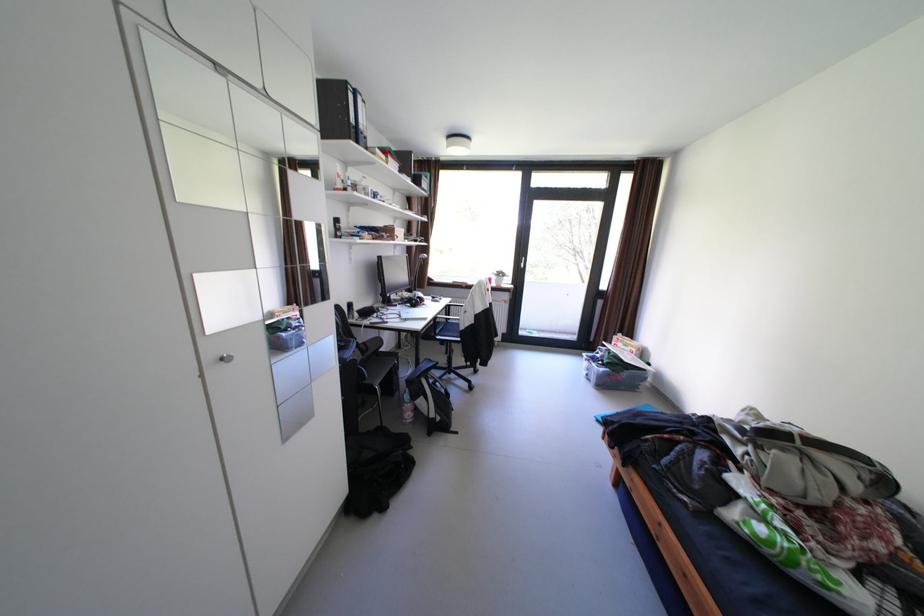
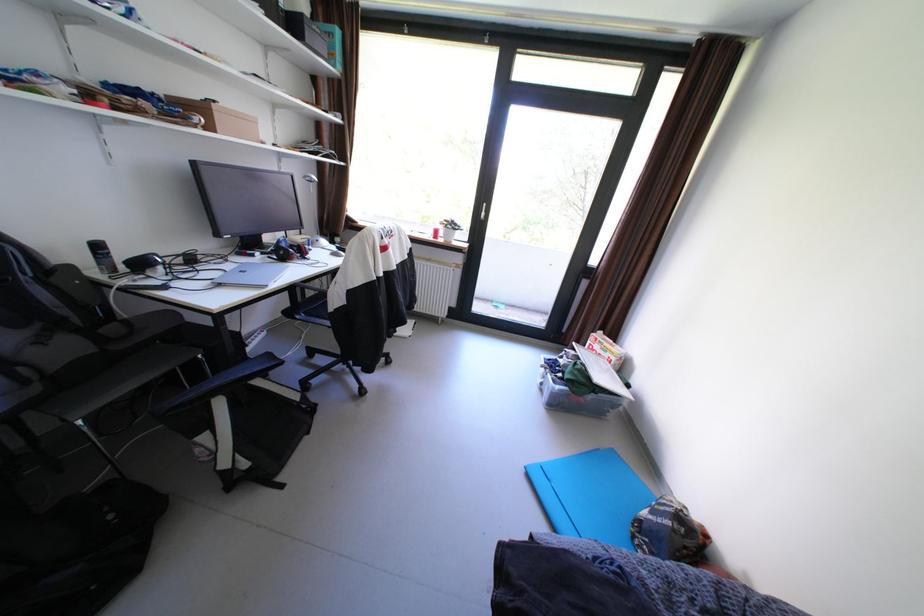
Where in the second image is the point corresponding to (448,338) from the first image?

(309, 317)